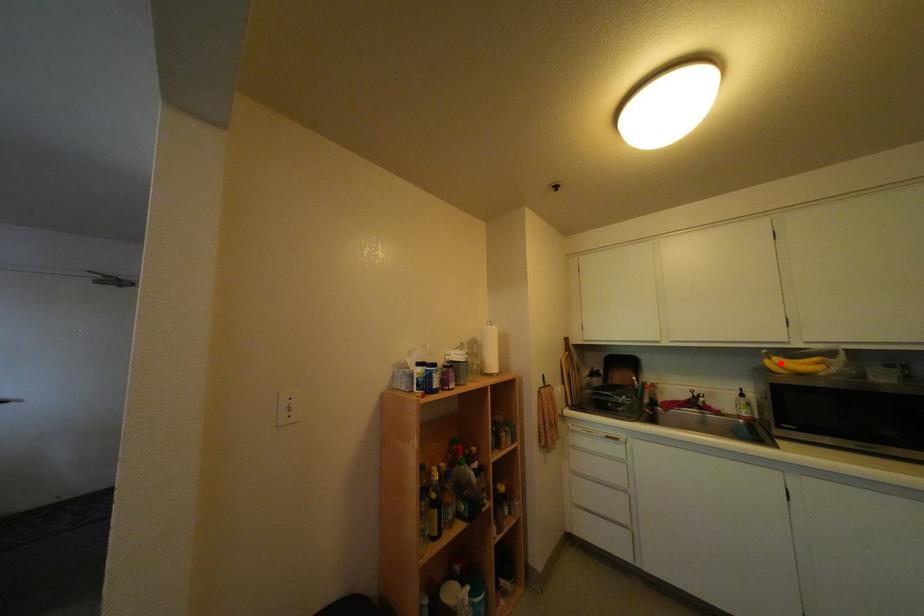
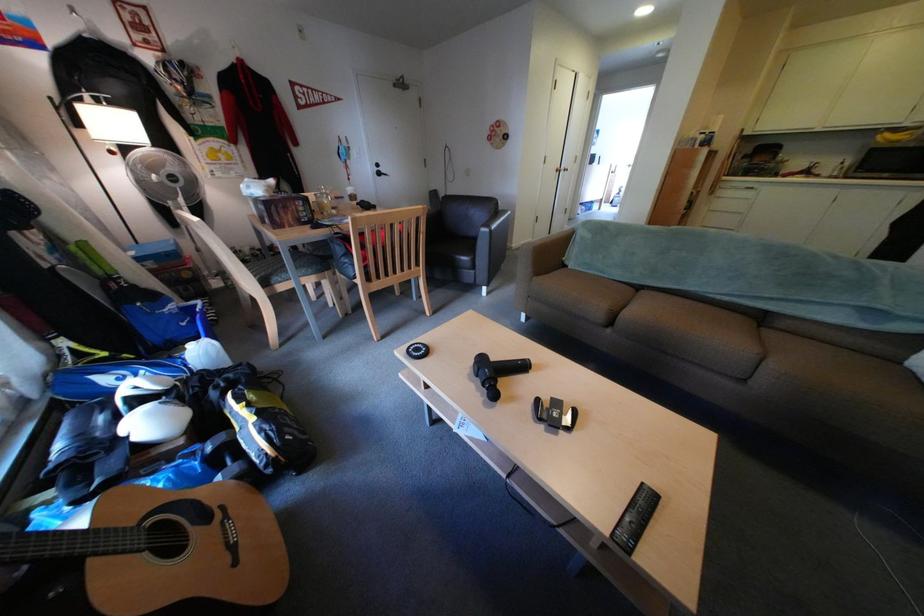
Question: A red point is marked in image1. In image2, is the corresponding 3D point closer to the camera or farther? Reply with the corresponding letter.

Choices:
 (A) The corresponding 3D point is closer.
 (B) The corresponding 3D point is farther.

Answer: (B)